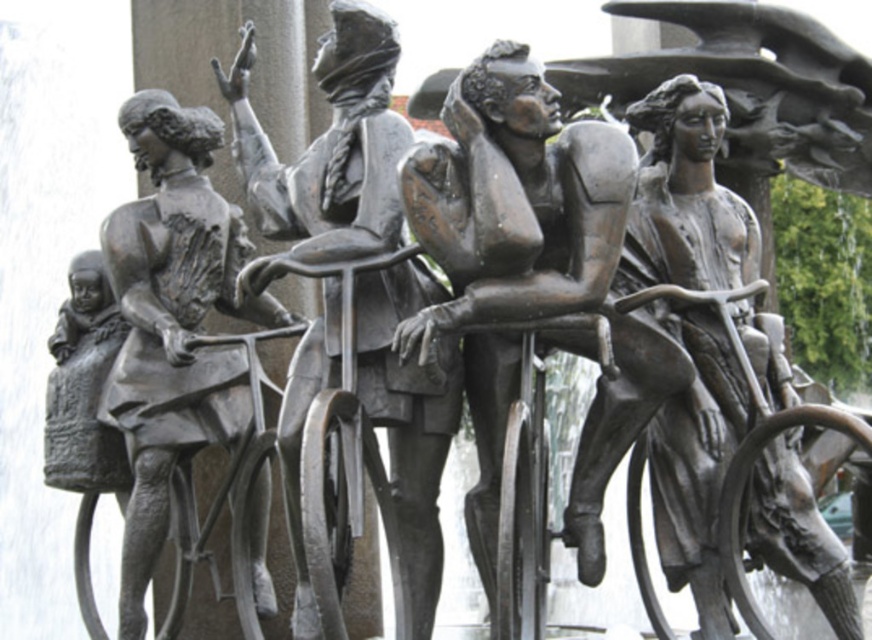
Identify the location of polished bronze bicycle at center. (327, 150).

Is point (273, 212) positioned after point (255, 515)?

No, (273, 212) is closer to viewer.

Find the location of `polished bronze bicycle at center`. polished bronze bicycle at center is located at coordinates (327, 150).

What are the coordinates of `bronze statue at center` in the screenshot? It's located at (530, 280).

Who is positioned more to the right, bronze statue at center or bronze statue of person at left?

From the viewer's perspective, bronze statue at center appears more on the right side.

Is point (590, 125) positioned after point (153, 106)?

No, (590, 125) is in front of (153, 106).

Where is `bronze statue at center`? Image resolution: width=872 pixels, height=640 pixels. bronze statue at center is located at coordinates (530, 280).

Is point (612, 131) in front of point (358, 19)?

Yes.

Who is taller, bronze statue at center or polished bronze bicycle at center?

With more height is polished bronze bicycle at center.

Does point (623, 198) come in front of point (372, 388)?

Yes.

In order to click on bronze statue at center in this screenshot , I will do point(530,280).